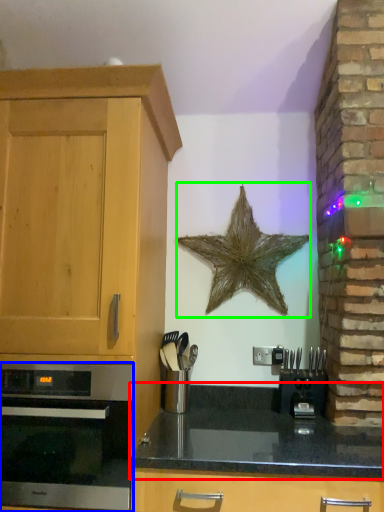
Question: Based on their relative distances, which object is nearer to countertop (highlighted by a red box)? Choose from oven (highlighted by a blue box) and starfish (highlighted by a green box).

Choices:
 (A) oven
 (B) starfish

Answer: (A)